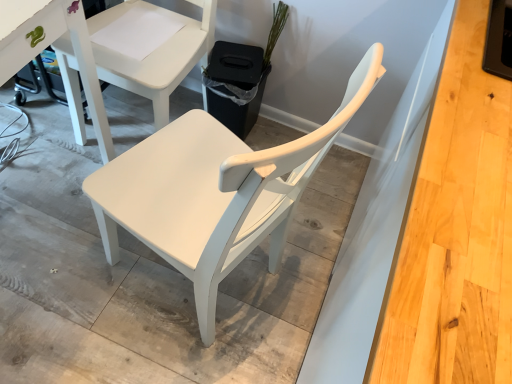
Question: Which direction should I rotate to look at white matte chair at center, which is the 2th chair from bottom to top?

Choices:
 (A) right
 (B) left

Answer: (B)

Question: Should I look upward or downward to see white matte chair at center, marked as the first chair in a bottom-to-top arrangement?

Choices:
 (A) down
 (B) up

Answer: (A)

Question: Considering the relative sizes of white matte chair at center, which is the 2th chair from bottom to top, and green matte plant at upper center in the image provided, is white matte chair at center, which is the 2th chair from bottom to top, thinner than green matte plant at upper center?

Choices:
 (A) yes
 (B) no

Answer: (B)

Question: Is white matte chair at center, which is counted as the first chair, starting from the top, in contact with green matte plant at upper center?

Choices:
 (A) no
 (B) yes

Answer: (A)

Question: From the image's perspective, does white matte chair at center, which is the 2th chair from bottom to top, appear lower than green matte plant at upper center?

Choices:
 (A) no
 (B) yes

Answer: (B)

Question: Is white matte chair at center, which is counted as the first chair, starting from the top, to the right of green matte plant at upper center from the viewer's perspective?

Choices:
 (A) yes
 (B) no

Answer: (B)

Question: Is white matte chair at center, which is counted as the first chair, starting from the top, positioned before green matte plant at upper center?

Choices:
 (A) yes
 (B) no

Answer: (A)

Question: Considering the relative sizes of white matte chair at center, which is counted as the first chair, starting from the top, and green matte plant at upper center in the image provided, is white matte chair at center, which is counted as the first chair, starting from the top, taller than green matte plant at upper center?

Choices:
 (A) yes
 (B) no

Answer: (A)

Question: Could you tell me if white matte chair at center, marked as the first chair in a bottom-to-top arrangement, is facing green matte plant at upper center?

Choices:
 (A) yes
 (B) no

Answer: (B)

Question: Is white matte chair at center, marked as the first chair in a bottom-to-top arrangement, shorter than green matte plant at upper center?

Choices:
 (A) no
 (B) yes

Answer: (B)

Question: From a real-world perspective, is white matte chair at center, positioned as the 2th chair in top-to-bottom order, physically above green matte plant at upper center?

Choices:
 (A) yes
 (B) no

Answer: (B)

Question: Considering the relative sizes of white matte chair at center, positioned as the 2th chair in top-to-bottom order, and green matte plant at upper center in the image provided, is white matte chair at center, positioned as the 2th chair in top-to-bottom order, thinner than green matte plant at upper center?

Choices:
 (A) no
 (B) yes

Answer: (A)

Question: Considering the relative sizes of white matte chair at center, positioned as the 2th chair in top-to-bottom order, and green matte plant at upper center in the image provided, is white matte chair at center, positioned as the 2th chair in top-to-bottom order, smaller than green matte plant at upper center?

Choices:
 (A) yes
 (B) no

Answer: (B)

Question: Considering the relative positions of white matte chair at center, positioned as the 2th chair in top-to-bottom order, and green matte plant at upper center in the image provided, is white matte chair at center, positioned as the 2th chair in top-to-bottom order, to the right of green matte plant at upper center from the viewer's perspective?

Choices:
 (A) yes
 (B) no

Answer: (B)

Question: Is green matte plant at upper center taller than white matte chair at center, which is the 2th chair from bottom to top?

Choices:
 (A) no
 (B) yes

Answer: (A)